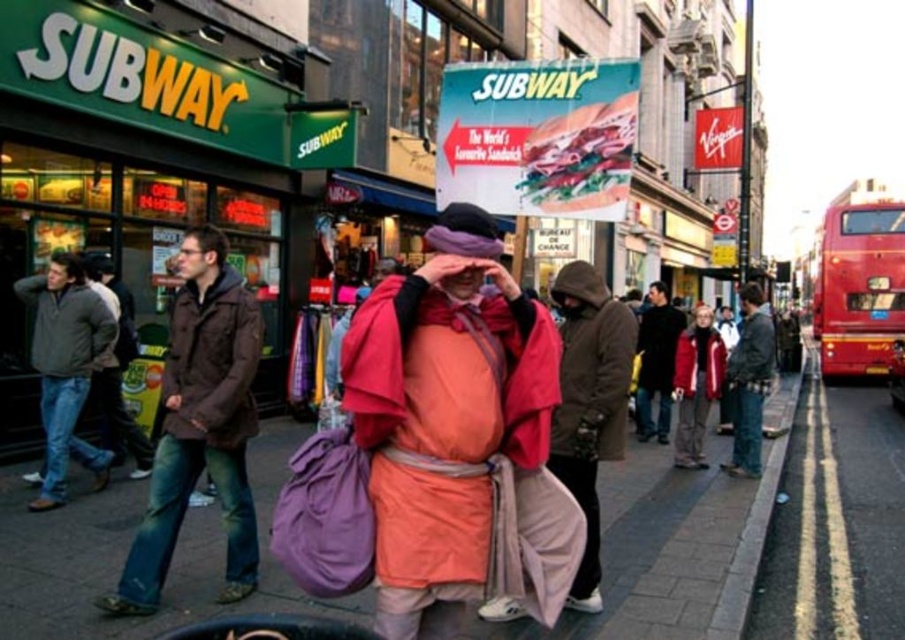
Question: Which object appears farthest from the camera in this image?

Choices:
 (A) brown puffy jacket at left
 (B) metallic red bus at right
 (C) dark brown leather jacket at center
 (D) pink fabric at center

Answer: (B)

Question: Can you confirm if gray fleece jacket at left is thinner than denim jacket at right?

Choices:
 (A) yes
 (B) no

Answer: (B)

Question: Does smooth concrete sidewalk at center appear under denim jacket at right?

Choices:
 (A) no
 (B) yes

Answer: (B)

Question: Considering the real-world distances, which object is closest to the dark brown leather jacket at center?

Choices:
 (A) denim jacket at right
 (B) orange cotton robe at center

Answer: (A)

Question: Considering the real-world distances, which object is closest to the pink fabric at center?

Choices:
 (A) denim jacket at right
 (B) gray fleece jacket at left
 (C) orange cotton robe at center
 (D) metallic red bus at right

Answer: (C)

Question: Considering the relative positions of denim jacket at right and red fleece jacket at center in the image provided, where is denim jacket at right located with respect to red fleece jacket at center?

Choices:
 (A) right
 (B) left

Answer: (A)